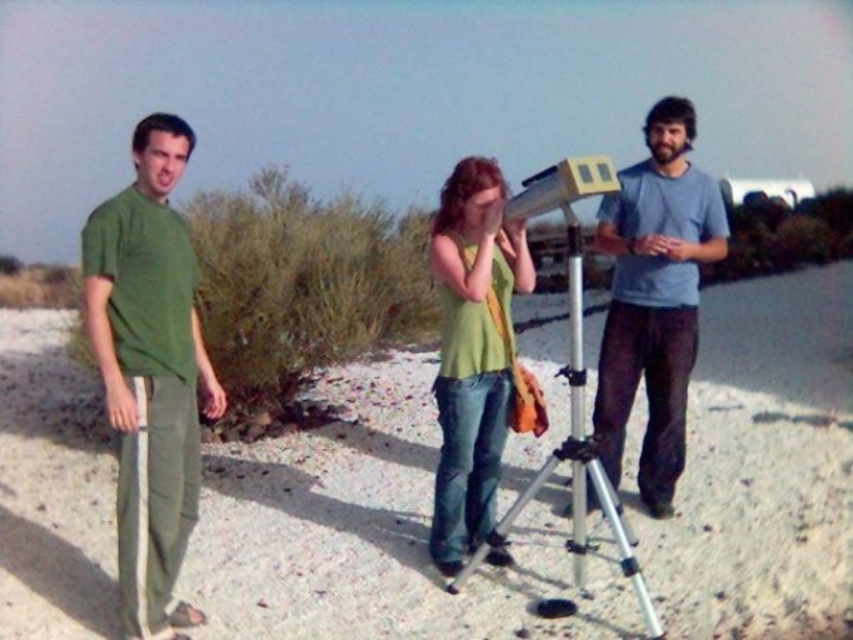
Where is the green cotton shirt at left located in the image?

The green cotton shirt at left is located at point 0.581 in the x coordinate and 0.176 in the y coordinate.

You are standing at the edge of the beach and want to place a 2.5 meter long telescope on the white sandy ground at center. Can you fit the telescope horizontally on the ground without overlapping any other objects?

The distance of white sandy ground at center from viewer is 3.65 meters. Since the telescope is 2.5 meters long, it can be placed horizontally on the white sandy ground at center as the available space is sufficient.